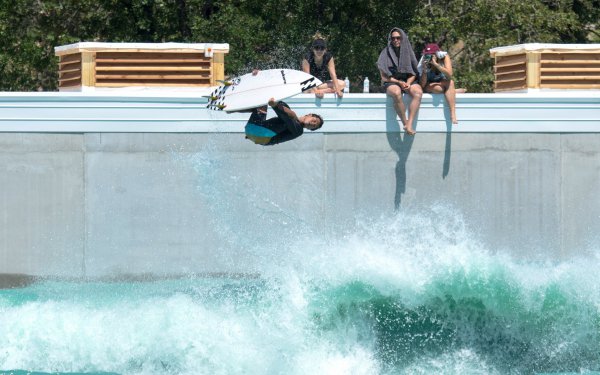
The image size is (600, 375). What are the coordinates of `grey wall` in the screenshot? It's located at (225, 207).